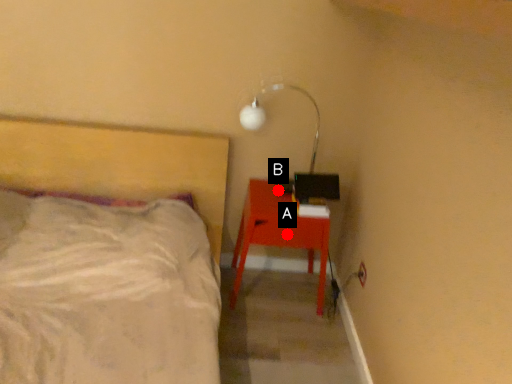
Question: Two points are circled on the image, labeled by A and B beside each circle. Which point appears farthest from the camera in this image?

Choices:
 (A) A is further
 (B) B is further

Answer: (B)